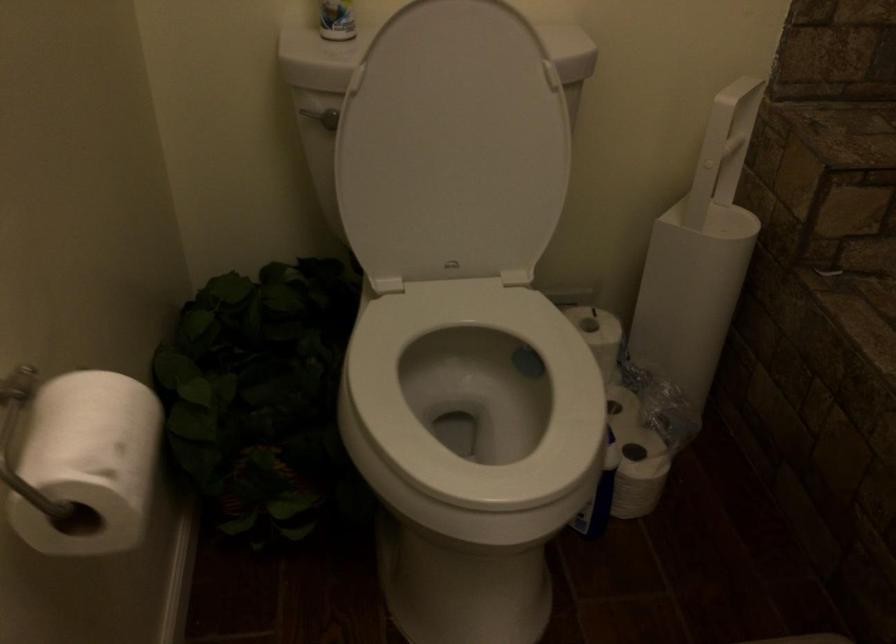
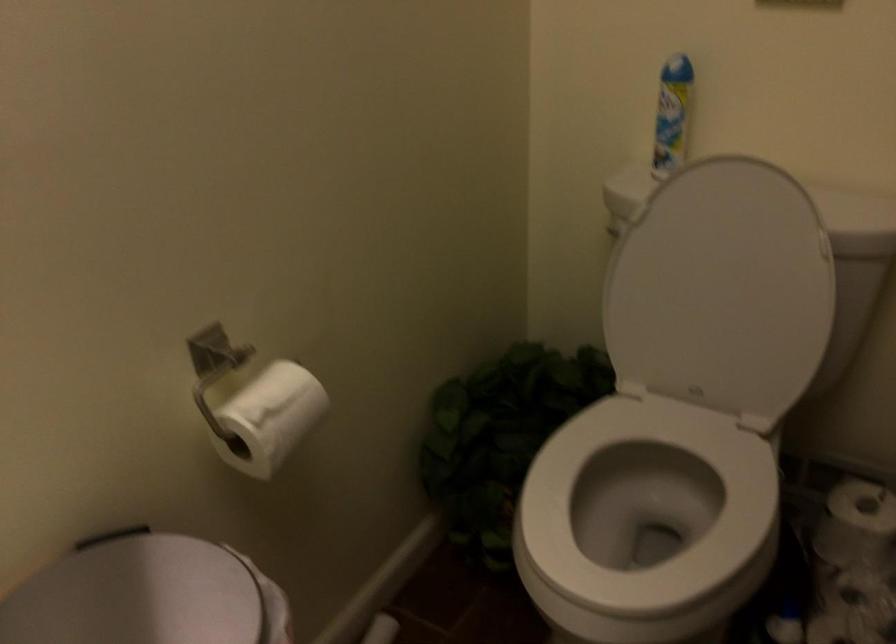
Where in the second image is the point corresponding to pixel 436 408 from the first image?

(645, 516)